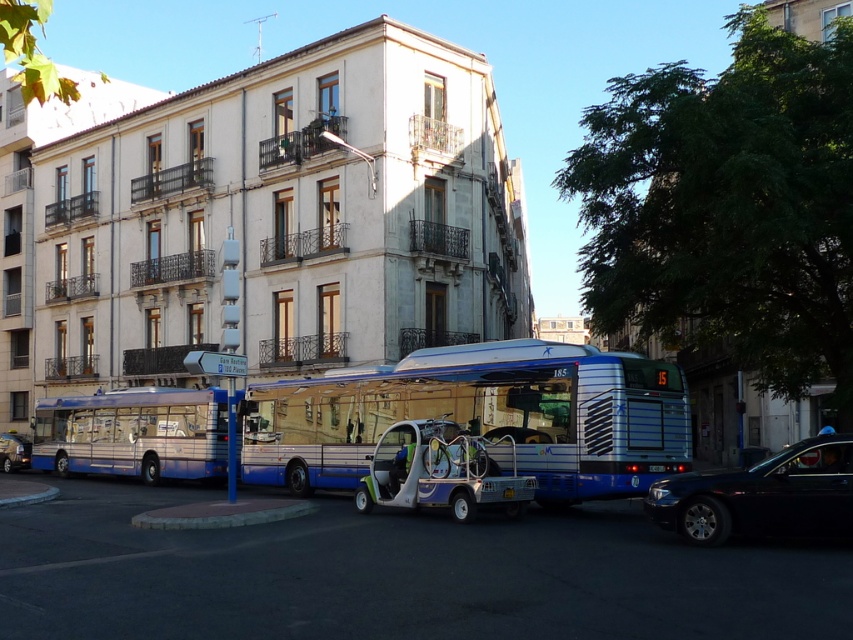
Which is behind, point (158, 456) or point (676, 513)?

The point (158, 456) is behind.

Does metallic blue bus at center appear on the right side of black glossy sedan at lower right?

Incorrect, metallic blue bus at center is not on the right side of black glossy sedan at lower right.

Between point (165, 456) and point (799, 486), which one is positioned behind?

The point (165, 456) is behind.

Locate an element on the screen. metallic blue bus at center is located at coordinates (134, 433).

Is black glossy sedan at lower right above metallic blue utility vehicle at center?

Correct, black glossy sedan at lower right is located above metallic blue utility vehicle at center.

Who is higher up, black glossy sedan at lower right or metallic blue utility vehicle at center?

Positioned higher is black glossy sedan at lower right.

I want to click on black glossy sedan at lower right, so click(x=762, y=496).

Which is below, metallic blue bus at center or metallic silver car at lower left?

metallic silver car at lower left is lower down.

Between metallic blue bus at center and metallic silver car at lower left, which one has less height?

metallic silver car at lower left

Is point (64, 403) in front of point (10, 464)?

That is True.

The height and width of the screenshot is (640, 853). In order to click on metallic blue bus at center in this screenshot , I will do `click(134, 433)`.